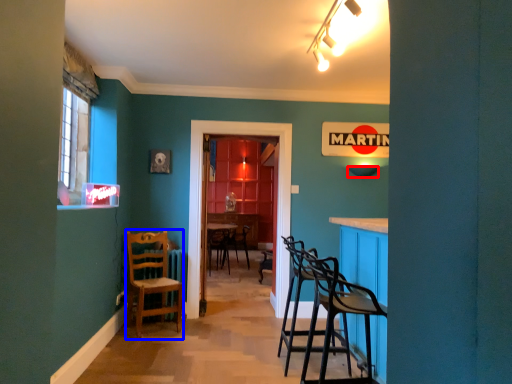
Question: Which of the following is the closest to the observer, lampshade (highlighted by a red box) or chair (highlighted by a blue box)?

Choices:
 (A) lampshade
 (B) chair

Answer: (B)